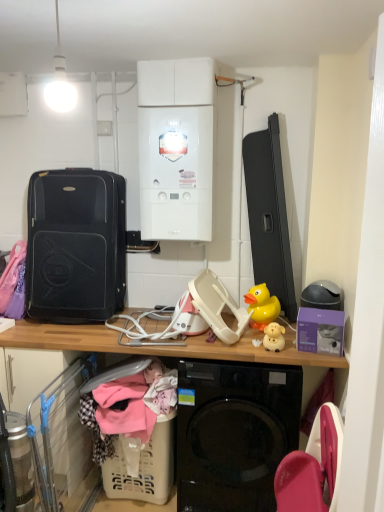
At what (x,y) coordinates should I click in order to perform the action: click on free spot in front of matte yellow plastic toy at center, the second toy positioned from the back. Please return your answer as a coordinate pair (x, y). Image resolution: width=384 pixels, height=512 pixels. Looking at the image, I should click on (288, 355).